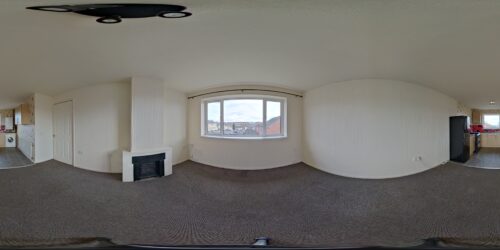
Locate an element on the screen. Image resolution: width=500 pixels, height=250 pixels. window on center right side is located at coordinates (490, 122).